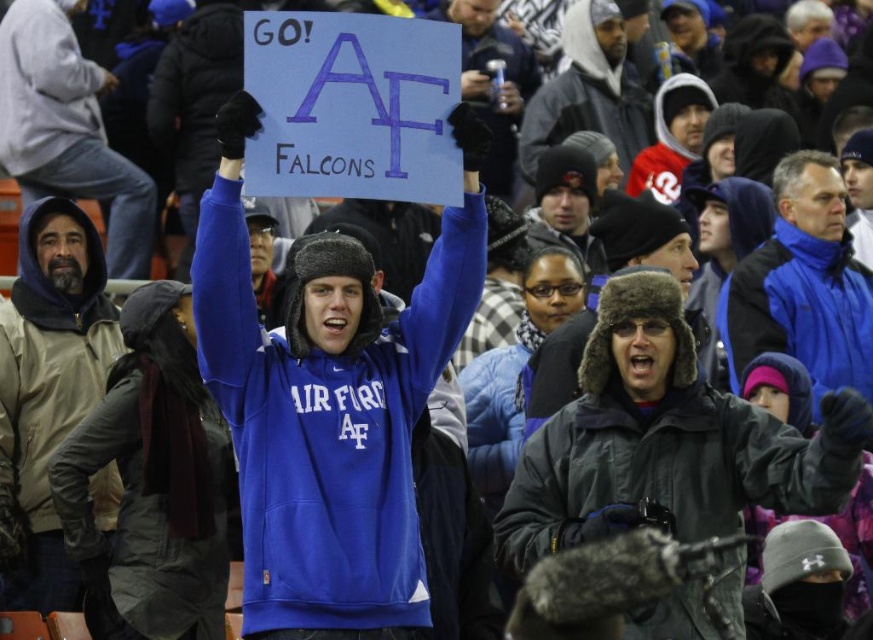
Is point (705, 636) behind point (610, 241)?

That is False.

Does dark gray fur-lined jacket at center have a larger size compared to dark gray fur-lined hat at center?

Correct, dark gray fur-lined jacket at center is larger in size than dark gray fur-lined hat at center.

Does point (606, 520) come farther from viewer compared to point (586, 321)?

No, (606, 520) is closer to viewer.

Find the location of a particular element. dark gray fur-lined jacket at center is located at coordinates (665, 442).

Does point (272, 508) lie behind point (555, 374)?

No, it is in front of (555, 374).

Which is more to the right, blue fleece sweatshirt at center or dark gray fur-lined hat at center?

dark gray fur-lined hat at center is more to the right.

Which is behind, point (327, 477) or point (557, 369)?

Point (557, 369)

You are a GUI agent. You are given a task and a screenshot of the screen. Output one action in this format:
    pyautogui.click(x=<x>, y=<y>)
    Task: Click on the blue fleece sweatshirt at center
    
    Given the screenshot: What is the action you would take?
    pyautogui.click(x=328, y=404)

Is blue fleece sweatshirt at center smaller than blue fleece jacket at upper right?

No.

Between point (368, 420) and point (731, 380), which one is positioned in front?

Point (368, 420) is in front.

Identify the location of blue fleece sweatshirt at center. (328, 404).